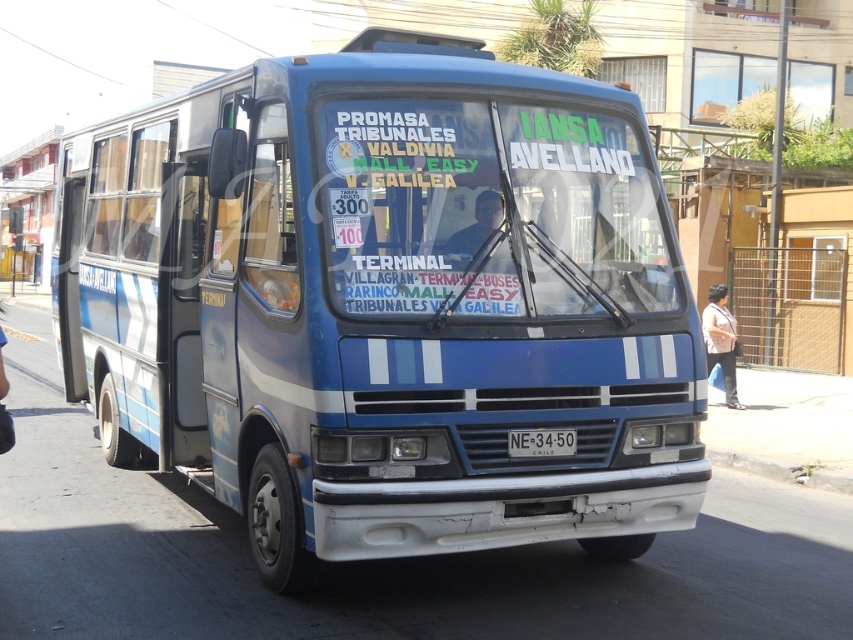
Question: Can you confirm if blue matte bus at center is positioned to the left of white plastic license plate at center?

Choices:
 (A) no
 (B) yes

Answer: (B)

Question: Where is blue matte bus at center located in relation to white plastic license plate at center in the image?

Choices:
 (A) below
 (B) above

Answer: (B)

Question: Which point is closer to the camera?

Choices:
 (A) white plastic license plate at center
 (B) blue matte bus at center

Answer: (B)

Question: Which point is closer to the camera?

Choices:
 (A) tap(548, 448)
 (B) tap(282, 518)

Answer: (A)

Question: Does blue matte bus at center have a greater width compared to white plastic license plate at center?

Choices:
 (A) no
 (B) yes

Answer: (B)